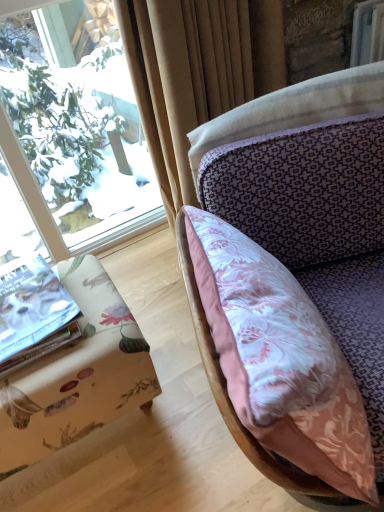
What do you see at coordinates (196, 73) in the screenshot? The image size is (384, 512). I see `silky beige curtain at upper center` at bounding box center [196, 73].

Where is `white paper book at lower left`? This screenshot has height=512, width=384. white paper book at lower left is located at coordinates (31, 305).

Looking at this image, considering the sizes of pink floral fabric pillow at center and silky beige curtain at upper center in the image, is pink floral fabric pillow at center wider or thinner than silky beige curtain at upper center?

Clearly, pink floral fabric pillow at center has more width compared to silky beige curtain at upper center.

Who is bigger, pink floral fabric pillow at center or silky beige curtain at upper center?

silky beige curtain at upper center is bigger.

Would you say pink floral fabric pillow at center is outside silky beige curtain at upper center?

pink floral fabric pillow at center lies outside silky beige curtain at upper center's area.

Between point (249, 459) and point (170, 64), which one is positioned behind?

Point (170, 64)

Is white paper book at lower left behind pink floral fabric pillow at center?

Yes, white paper book at lower left is behind pink floral fabric pillow at center.

Can you tell me how much white paper book at lower left and pink floral fabric pillow at center differ in facing direction?

They differ by 68.9 degrees in their facing directions.

Locate an element on the screen. pillow above the white paper book at lower left (from the image's perspective) is located at coordinates [234, 410].

Is point (55, 330) farther from viewer compared to point (290, 468)?

Yes, it is behind point (290, 468).

From a real-world perspective, who is located lower, floral fabric ottoman at lower left or white paper book at lower left?

floral fabric ottoman at lower left.

Between floral fabric ottoman at lower left and white paper book at lower left, which one has larger width?

Wider between the two is floral fabric ottoman at lower left.

Consider the image. Which of these two, floral fabric ottoman at lower left or white paper book at lower left, stands shorter?

With less height is white paper book at lower left.

Is floral fabric ottoman at lower left in front of white paper book at lower left?

Yes, it is.

From the image's perspective, which is above, floral fabric ottoman at lower left or silky beige curtain at upper center?

silky beige curtain at upper center is shown above in the image.

Which object is more forward, floral fabric ottoman at lower left or silky beige curtain at upper center?

floral fabric ottoman at lower left.

Which of these two, floral fabric ottoman at lower left or silky beige curtain at upper center, stands taller?

silky beige curtain at upper center.

Is point (143, 387) closer or farther from the camera than point (236, 93)?

Point (143, 387).

Which of these two, floral fabric ottoman at lower left or pink floral fabric pillow at center, is thinner?

Thinner between the two is pink floral fabric pillow at center.

Considering the sizes of objects floral fabric ottoman at lower left and pink floral fabric pillow at center in the image provided, who is taller, floral fabric ottoman at lower left or pink floral fabric pillow at center?

pink floral fabric pillow at center.

Based on the photo, from a real-world perspective, is floral fabric ottoman at lower left physically above pink floral fabric pillow at center?

No, from a real-world perspective, floral fabric ottoman at lower left is not on top of pink floral fabric pillow at center.

Considering the relative positions of floral fabric ottoman at lower left and pink floral fabric pillow at center in the image provided, is floral fabric ottoman at lower left to the right of pink floral fabric pillow at center from the viewer's perspective?

In fact, floral fabric ottoman at lower left is to the left of pink floral fabric pillow at center.

Is silky beige curtain at upper center oriented towards floral fabric ottoman at lower left?

No, silky beige curtain at upper center is not facing towards floral fabric ottoman at lower left.

Can you confirm if silky beige curtain at upper center is thinner than floral fabric ottoman at lower left?

Yes.

Where is `curtain on the right of floral fabric ottoman at lower left`? The height and width of the screenshot is (512, 384). curtain on the right of floral fabric ottoman at lower left is located at coordinates (196, 73).

Is floral fabric ottoman at lower left completely or partially inside silky beige curtain at upper center?

No, floral fabric ottoman at lower left is located outside of silky beige curtain at upper center.

Is silky beige curtain at upper center not close to pink floral fabric pillow at center?

That's not correct — silky beige curtain at upper center is a little close to pink floral fabric pillow at center.

Is silky beige curtain at upper center positioned before pink floral fabric pillow at center?

No.

From a real-world perspective, is silky beige curtain at upper center beneath pink floral fabric pillow at center?

Actually, silky beige curtain at upper center is physically above pink floral fabric pillow at center in the real world.

Which point is more distant from viewer, (139, 80) or (220, 380)?

The point (139, 80) is behind.

You are a GUI agent. You are given a task and a screenshot of the screen. Output one action in this format:
    pyautogui.click(x=<x>, y=<y>)
    Task: Click on the pillow lying in front of the silky beige curtain at upper center
    
    Given the screenshot: What is the action you would take?
    pyautogui.click(x=234, y=410)

You are a GUI agent. You are given a task and a screenshot of the screen. Output one action in this format:
    pyautogui.click(x=<x>, y=<y>)
    Task: Click on the pillow above the white paper book at lower left (from the image's perspective)
    Image resolution: width=384 pixels, height=512 pixels.
    Given the screenshot: What is the action you would take?
    pyautogui.click(x=234, y=410)

Estimate the real-world distances between objects in this image. Which object is further from floral fabric ottoman at lower left, white paper book at lower left or silky beige curtain at upper center?

silky beige curtain at upper center.

From the image, which object appears to be farther from pink floral fabric pillow at center, white paper book at lower left or floral fabric ottoman at lower left?

white paper book at lower left.

Looking at the image, which one is located further to silky beige curtain at upper center, pink floral fabric pillow at center or white paper book at lower left?

white paper book at lower left lies further to silky beige curtain at upper center than the other object.

Considering their positions, is silky beige curtain at upper center positioned further to white paper book at lower left than floral fabric ottoman at lower left?

The object further to white paper book at lower left is silky beige curtain at upper center.

Looking at the image, which one is located further to pink floral fabric pillow at center, floral fabric ottoman at lower left or silky beige curtain at upper center?

silky beige curtain at upper center is positioned further to the anchor pink floral fabric pillow at center.

Estimate the real-world distances between objects in this image. Which object is closer to white paper book at lower left, pink floral fabric pillow at center or silky beige curtain at upper center?

Based on the image, pink floral fabric pillow at center appears to be nearer to white paper book at lower left.

Which object lies nearer to the anchor point silky beige curtain at upper center, pink floral fabric pillow at center or floral fabric ottoman at lower left?

pink floral fabric pillow at center.

When comparing their distances from white paper book at lower left, does pink floral fabric pillow at center or floral fabric ottoman at lower left seem closer?

floral fabric ottoman at lower left lies closer to white paper book at lower left than the other object.

Find the location of a particular element. Image resolution: width=384 pixels, height=512 pixels. pillow between silky beige curtain at upper center and white paper book at lower left in the vertical direction is located at coordinates (234, 410).

Where is `pillow between silky beige curtain at upper center and floral fabric ottoman at lower left from top to bottom`? pillow between silky beige curtain at upper center and floral fabric ottoman at lower left from top to bottom is located at coordinates (234, 410).

What are the coordinates of `book between silky beige curtain at upper center and floral fabric ottoman at lower left in the vertical direction` in the screenshot? It's located at (31, 305).

You are a GUI agent. You are given a task and a screenshot of the screen. Output one action in this format:
    pyautogui.click(x=<x>, y=<y>)
    Task: Click on the furniture between white paper book at lower left and pink floral fabric pillow at center from left to right
    The height and width of the screenshot is (512, 384).
    Given the screenshot: What is the action you would take?
    pyautogui.click(x=77, y=374)